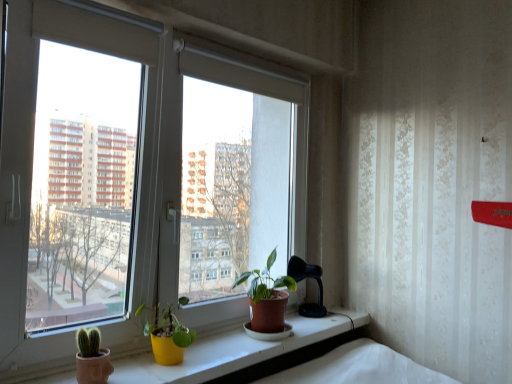
Where is `matte yellow pot at center`? matte yellow pot at center is located at coordinates (234, 351).

What do you see at coordinates (234, 351) in the screenshot? The height and width of the screenshot is (384, 512). I see `matte yellow pot at center` at bounding box center [234, 351].

Locate an element on the screen. Image resolution: width=512 pixels, height=384 pixels. matte yellow pot at center is located at coordinates (234, 351).

Is matte yellow pot at center far from matte brown pot at center, placed as the first houseplant when sorted from right to left?

matte yellow pot at center is actually quite close to matte brown pot at center, placed as the first houseplant when sorted from right to left.

From the image's perspective, is matte yellow pot at center under matte brown pot at center, positioned as the 1th houseplant in back-to-front order?

Indeed, from the image's perspective, matte yellow pot at center is shown beneath matte brown pot at center, positioned as the 1th houseplant in back-to-front order.

In the scene shown: Between matte yellow pot at center and matte brown pot at center, the second houseplant positioned from the front, which one appears on the right side from the viewer's perspective?

From the viewer's perspective, matte brown pot at center, the second houseplant positioned from the front, appears more on the right side.

In the scene shown: Does matte yellow pot at center have a larger size compared to matte brown pot at center, positioned as the 1th houseplant in back-to-front order?

Indeed, matte yellow pot at center has a larger size compared to matte brown pot at center, positioned as the 1th houseplant in back-to-front order.

Is matte yellow pot at center located outside white plastic window at center?

Yes, matte yellow pot at center is outside of white plastic window at center.

Is the position of matte yellow pot at center less distant than that of white plastic window at center?

Yes, it is in front of white plastic window at center.

Which object is positioned more to the left, matte yellow pot at center or white plastic window at center?

Positioned to the left is white plastic window at center.

From the image's perspective, does matte yellow pot at center appear lower than white plastic window at center?

Yes, from the image's perspective, matte yellow pot at center is beneath white plastic window at center.

Considering the relative sizes of yellow matte pot at lower center, the second houseplant in the right-to-left sequence, and matte yellow pot at center in the image provided, is yellow matte pot at lower center, the second houseplant in the right-to-left sequence, smaller than matte yellow pot at center?

Yes, yellow matte pot at lower center, the second houseplant in the right-to-left sequence, is smaller than matte yellow pot at center.

Where is `houseplant that is the 1st object above the matte yellow pot at center (from a real-world perspective)`? The height and width of the screenshot is (384, 512). houseplant that is the 1st object above the matte yellow pot at center (from a real-world perspective) is located at coordinates (167, 335).

Is yellow matte pot at lower center, which ranks as the second houseplant in back-to-front order, closer to the viewer compared to matte yellow pot at center?

No, it is not.

Does matte brown pot at center, placed as the first houseplant when sorted from right to left, have a greater height compared to yellow matte pot at lower center, the second houseplant in the right-to-left sequence?

Indeed, matte brown pot at center, placed as the first houseplant when sorted from right to left, has a greater height compared to yellow matte pot at lower center, the second houseplant in the right-to-left sequence.

Based on the photo, does matte brown pot at center, the second houseplant positioned from the front, have a larger size compared to yellow matte pot at lower center, the first houseplant in the front-to-back sequence?

Correct, matte brown pot at center, the second houseplant positioned from the front, is larger in size than yellow matte pot at lower center, the first houseplant in the front-to-back sequence.

Is matte brown pot at center, positioned as the 1th houseplant in back-to-front order, beside yellow matte pot at lower center, the first houseplant in the front-to-back sequence?

There is a gap between matte brown pot at center, positioned as the 1th houseplant in back-to-front order, and yellow matte pot at lower center, the first houseplant in the front-to-back sequence.

How much distance is there between matte brown pot at center, positioned as the 1th houseplant in back-to-front order, and yellow matte pot at lower center, the first houseplant in the front-to-back sequence?

They are 13.91 inches apart.

Is yellow matte pot at lower center, which ranks as the second houseplant in back-to-front order, positioned in front of matte brown pot at center, positioned as the 2th houseplant in left-to-right order?

Yes.

Can you confirm if yellow matte pot at lower center, the second houseplant in the right-to-left sequence, is positioned to the right of matte brown pot at center, placed as the first houseplant when sorted from right to left?

No, yellow matte pot at lower center, the second houseplant in the right-to-left sequence, is not to the right of matte brown pot at center, placed as the first houseplant when sorted from right to left.

Does yellow matte pot at lower center, the second houseplant in the right-to-left sequence, have a greater height compared to matte brown pot at center, placed as the first houseplant when sorted from right to left?

No.

From a real-world perspective, is white plastic window at center beneath matte yellow pot at center?

No, from a real-world perspective, white plastic window at center is not under matte yellow pot at center.

Does white plastic window at center have a greater width compared to matte yellow pot at center?

No.

Considering the relative positions of white plastic window at center and matte yellow pot at center in the image provided, is white plastic window at center to the left of matte yellow pot at center from the viewer's perspective?

Correct, you'll find white plastic window at center to the left of matte yellow pot at center.

Looking at this image, what's the angular difference between white plastic window at center and matte yellow pot at center's facing directions?

0.0217 degrees.

Is matte yellow pot at center not within yellow matte pot at lower center, the second houseplant in the right-to-left sequence?

matte yellow pot at center lies outside yellow matte pot at lower center, the second houseplant in the right-to-left sequence,'s area.

Considering the relative sizes of matte yellow pot at center and yellow matte pot at lower center, which ranks as the second houseplant in back-to-front order, in the image provided, is matte yellow pot at center thinner than yellow matte pot at lower center, which ranks as the second houseplant in back-to-front order,?

No, matte yellow pot at center is not thinner than yellow matte pot at lower center, which ranks as the second houseplant in back-to-front order.

How different are the orientations of matte yellow pot at center and yellow matte pot at lower center, the first houseplant in the front-to-back sequence, in degrees?

matte yellow pot at center and yellow matte pot at lower center, the first houseplant in the front-to-back sequence, are facing 1.69 degrees away from each other.

Would you consider matte yellow pot at center to be distant from yellow matte pot at lower center, the second houseplant in the right-to-left sequence?

No.

The width and height of the screenshot is (512, 384). In order to click on the 2nd houseplant behind the matte yellow pot at center, counting from the anchor's position in this screenshot , I will do `click(267, 297)`.

Find the location of a particular element. Image resolution: width=512 pixels, height=384 pixels. window that is on the left side of matte yellow pot at center is located at coordinates (136, 183).

Estimate the real-world distances between objects in this image. Which object is closer to white plastic window at center, matte yellow pot at center or yellow matte pot at lower center, which ranks as the second houseplant in back-to-front order?

yellow matte pot at lower center, which ranks as the second houseplant in back-to-front order, is closer to white plastic window at center.

From the image, which object appears to be nearer to matte yellow pot at center, yellow matte pot at lower center, the 1th houseplant when ordered from left to right, or white plastic window at center?

Based on the image, yellow matte pot at lower center, the 1th houseplant when ordered from left to right, appears to be nearer to matte yellow pot at center.

Considering their positions, is yellow matte pot at lower center, the 1th houseplant when ordered from left to right, positioned further to matte yellow pot at center than matte brown pot at center, positioned as the 1th houseplant in back-to-front order?

The object further to matte yellow pot at center is matte brown pot at center, positioned as the 1th houseplant in back-to-front order.

When comparing their distances from white plastic window at center, does matte brown pot at center, positioned as the 2th houseplant in left-to-right order, or matte yellow pot at center seem further?

The object further to white plastic window at center is matte yellow pot at center.

Looking at the image, which one is located closer to matte brown pot at center, positioned as the 1th houseplant in back-to-front order, yellow matte pot at lower center, which ranks as the second houseplant in back-to-front order, or white plastic window at center?

yellow matte pot at lower center, which ranks as the second houseplant in back-to-front order, lies closer to matte brown pot at center, positioned as the 1th houseplant in back-to-front order, than the other object.

From the image, which object appears to be farther from white plastic window at center, matte yellow pot at center or matte brown pot at center, positioned as the 2th houseplant in left-to-right order?

Among the two, matte yellow pot at center is located further to white plastic window at center.

Which object lies nearer to the anchor point white plastic window at center, yellow matte pot at lower center, the first houseplant in the front-to-back sequence, or matte yellow pot at center?

yellow matte pot at lower center, the first houseplant in the front-to-back sequence, is closer to white plastic window at center.

When comparing their distances from yellow matte pot at lower center, the first houseplant in the front-to-back sequence, does matte yellow pot at center or matte brown pot at center, positioned as the 1th houseplant in back-to-front order, seem closer?

matte yellow pot at center is positioned closer to the anchor yellow matte pot at lower center, the first houseplant in the front-to-back sequence.

Find the location of a particular element. houseplant between matte yellow pot at center and matte brown pot at center, positioned as the 1th houseplant in back-to-front order, in the front-back direction is located at coordinates (167, 335).

Where is `houseplant between white plastic window at center and yellow matte pot at lower center, the 1th houseplant when ordered from left to right, in the up-down direction`? The height and width of the screenshot is (384, 512). houseplant between white plastic window at center and yellow matte pot at lower center, the 1th houseplant when ordered from left to right, in the up-down direction is located at coordinates (267, 297).